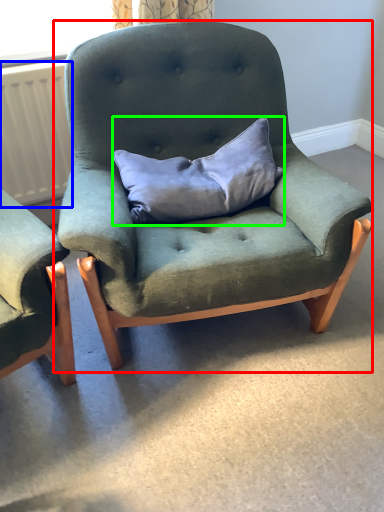
Question: Estimate the real-world distances between objects in this image. Which object is farther from chair (highlighted by a red box), radiator (highlighted by a blue box) or pillow (highlighted by a green box)?

Choices:
 (A) radiator
 (B) pillow

Answer: (A)